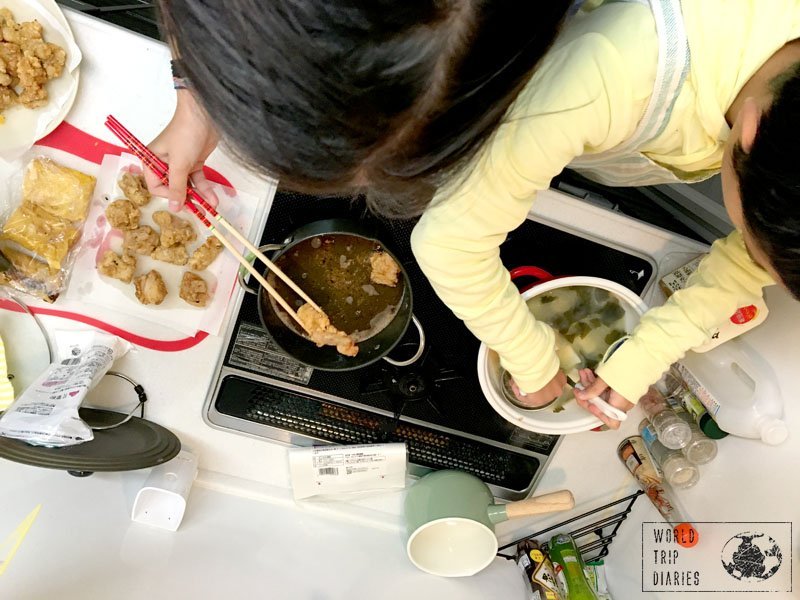
Locate an element on the screen. The width and height of the screenshot is (800, 600). stovetop is located at coordinates (434, 324).